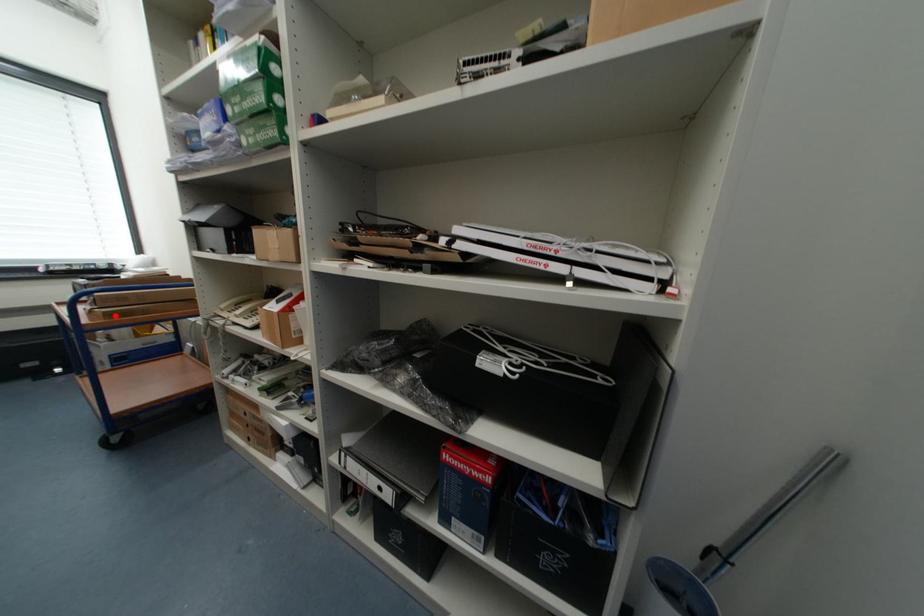
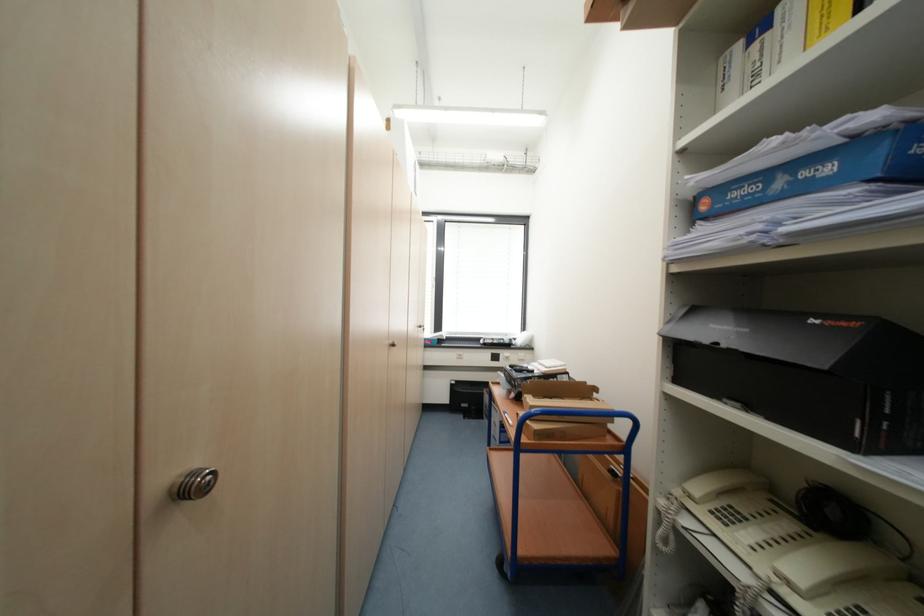
Where in the second image is the point corresponding to the highlighted location from the first image?

(544, 436)